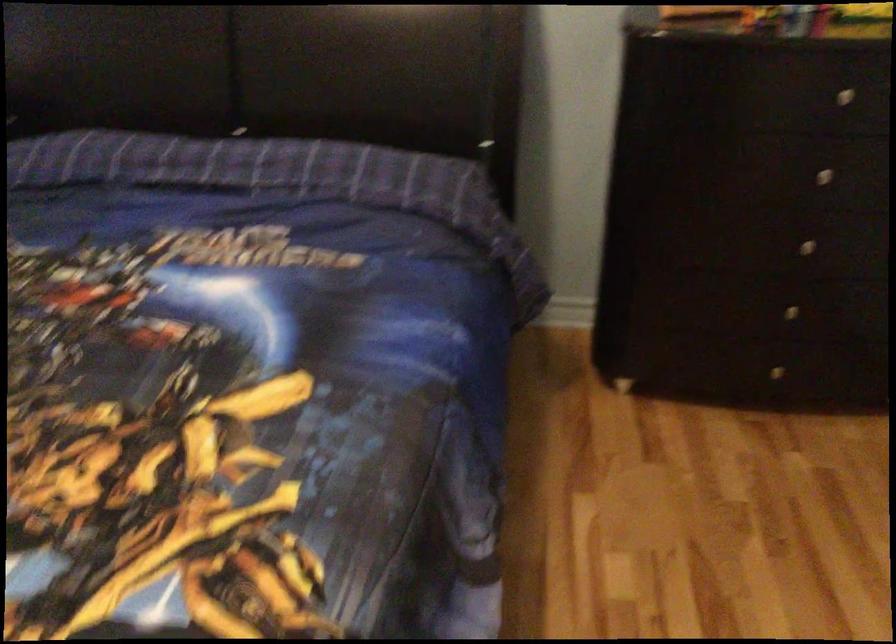
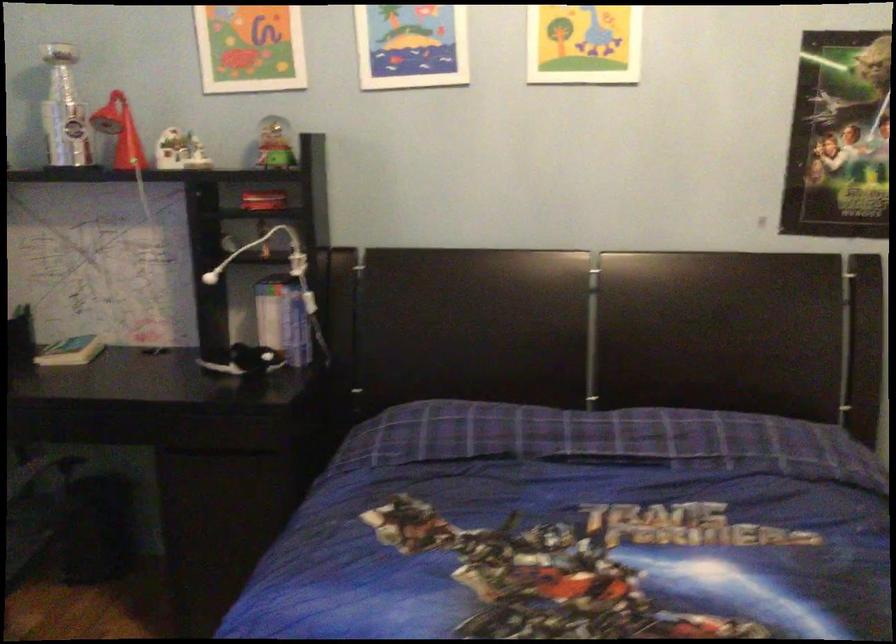
Question: The first image is from the beginning of the video and the second image is from the end. How did the camera likely rotate when shooting the video?

Choices:
 (A) Left
 (B) Right
 (C) Up
 (D) Down

Answer: (C)